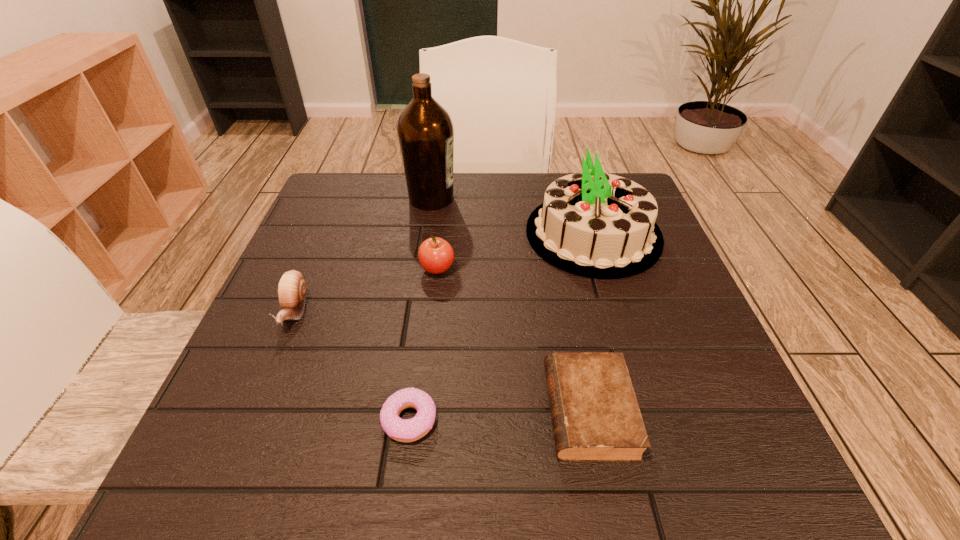
At what (x,y) coordinates should I click in order to perform the action: click on vacant area between the apple and the third nearest object. Please return your answer as a coordinate pair (x, y). The height and width of the screenshot is (540, 960). Looking at the image, I should click on (366, 290).

The width and height of the screenshot is (960, 540). Find the location of `free space between the second shortest object and the doughnut`. free space between the second shortest object and the doughnut is located at coordinates (499, 415).

The image size is (960, 540). Identify the location of vacant area between the fifth tallest object and the doughnut. pos(499,415).

The width and height of the screenshot is (960, 540). I want to click on blank region between the doughnut and the diary, so click(x=499, y=415).

Where is `free area in between the doughnut and the olive oil`? free area in between the doughnut and the olive oil is located at coordinates (420, 309).

Where is `vacant space that is in between the diary and the apple`? vacant space that is in between the diary and the apple is located at coordinates (513, 340).

Find the location of a particular element. This screenshot has width=960, height=540. object that is the fourth closest to the doughnut is located at coordinates (596, 225).

Locate which object ranks third in proximity to the diary. Please provide its 2D coordinates. Your answer should be formatted as a tuple, i.e. [(x, y)], where the tuple contains the x and y coordinates of a point satisfying the conditions above.

[(436, 255)]

Where is `vacant space that satisfies the following two spatial constraints: 1. on the back side of the apple; 2. on the label of the tallest object`? Image resolution: width=960 pixels, height=540 pixels. vacant space that satisfies the following two spatial constraints: 1. on the back side of the apple; 2. on the label of the tallest object is located at coordinates (444, 198).

The image size is (960, 540). Identify the location of vacant space that satisfies the following two spatial constraints: 1. on the back side of the doughnut; 2. on the left side of the apple. (428, 269).